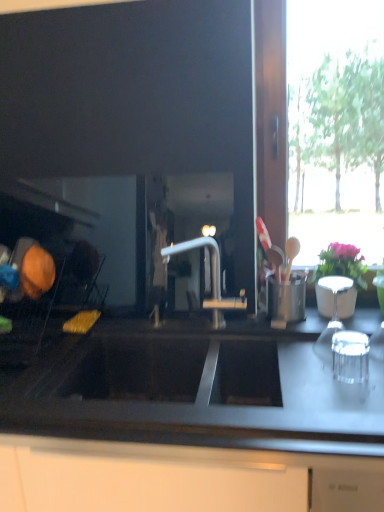
Question: Looking at their shapes, would you say pink matte vase at upper right is wider or thinner than black matte countertop at center?

Choices:
 (A) wide
 (B) thin

Answer: (B)

Question: Considering their positions, is pink matte vase at upper right located in front of or behind black matte countertop at center?

Choices:
 (A) front
 (B) behind

Answer: (B)

Question: Choose the correct answer: Is pink matte vase at upper right inside black matte countertop at center or outside it?

Choices:
 (A) inside
 (B) outside

Answer: (B)

Question: In terms of width, does black matte countertop at center look wider or thinner when compared to pink matte vase at upper right?

Choices:
 (A) wide
 (B) thin

Answer: (A)

Question: From the image's perspective, is black matte countertop at center located above or below pink matte vase at upper right?

Choices:
 (A) below
 (B) above

Answer: (A)

Question: Considering their positions, is black matte countertop at center located in front of or behind pink matte vase at upper right?

Choices:
 (A) front
 (B) behind

Answer: (A)

Question: Is black matte countertop at center situated inside pink matte vase at upper right or outside?

Choices:
 (A) inside
 (B) outside

Answer: (B)